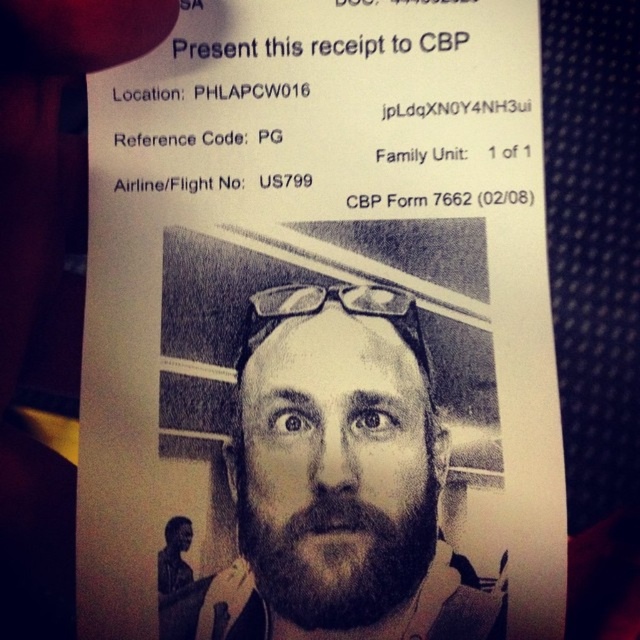
Who is more distant from viewer, (x=291, y=401) or (x=333, y=547)?

Point (x=291, y=401)

Does point (355, 426) come in front of point (387, 584)?

No, (355, 426) is behind (387, 584).

Where is `beige textured beard at center`? This screenshot has height=640, width=640. beige textured beard at center is located at coordinates (340, 480).